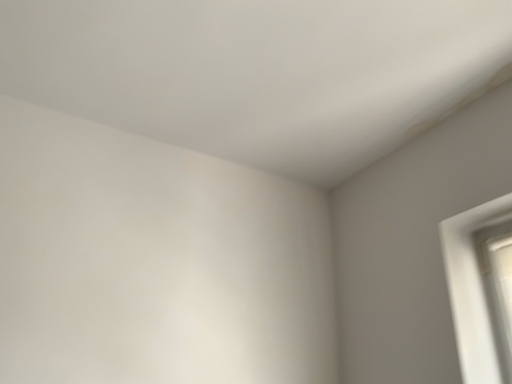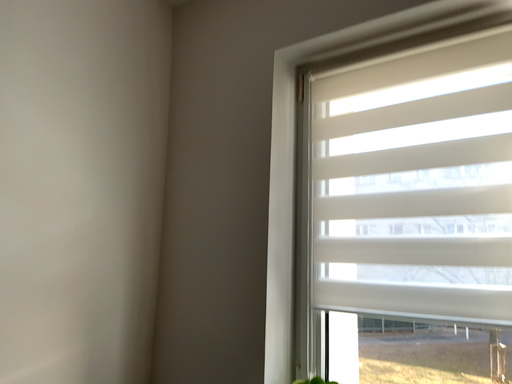
Question: How did the camera likely rotate when shooting the video?

Choices:
 (A) rotated downward
 (B) rotated upward

Answer: (A)